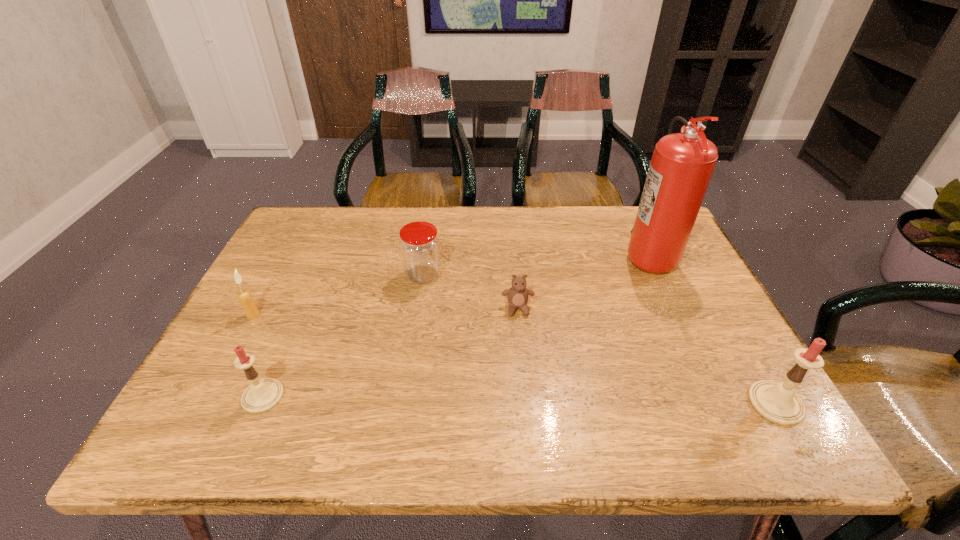
This screenshot has width=960, height=540. I want to click on vacant region located on the left of the rightmost candle, so click(574, 403).

This screenshot has height=540, width=960. In order to click on vacant space positioned on the back of the fourth object from right to left in this screenshot , I will do `click(429, 235)`.

Locate an element on the screen. The image size is (960, 540). free space located on the front-facing side of the teddy bear is located at coordinates (523, 372).

You are a GUI agent. You are given a task and a screenshot of the screen. Output one action in this format:
    pyautogui.click(x=<x>, y=<y>)
    Task: Click on the free space located on the right of the farthest candle
    The width and height of the screenshot is (960, 540).
    Given the screenshot: What is the action you would take?
    pyautogui.click(x=309, y=315)

The height and width of the screenshot is (540, 960). Identify the location of vacant space located on the instruction side of the fire extinguisher. (516, 254).

The height and width of the screenshot is (540, 960). Find the location of `vacant region located 0.170m on the instruction side of the fire extinguisher`. vacant region located 0.170m on the instruction side of the fire extinguisher is located at coordinates (564, 254).

I want to click on free space located on the instruction side of the fire extinguisher, so pyautogui.click(x=539, y=254).

At what (x,y) coordinates should I click in order to perform the action: click on object that is at the far edge. Please return your answer as a coordinate pair (x, y). This screenshot has height=540, width=960. Looking at the image, I should click on (682, 164).

The width and height of the screenshot is (960, 540). What are the coordinates of `candle that is at the right edge` in the screenshot? It's located at (777, 402).

The image size is (960, 540). In order to click on fire extinguisher at the right edge in this screenshot , I will do `click(682, 164)`.